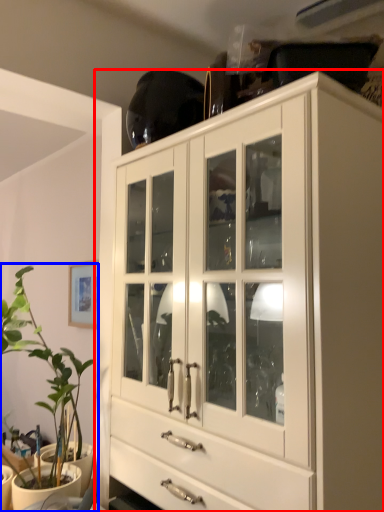
Question: Which object is closer to the camera taking this photo, cabinetry (highlighted by a red box) or houseplant (highlighted by a blue box)?

Choices:
 (A) cabinetry
 (B) houseplant

Answer: (A)